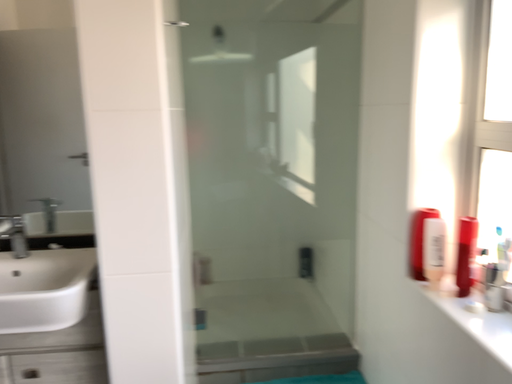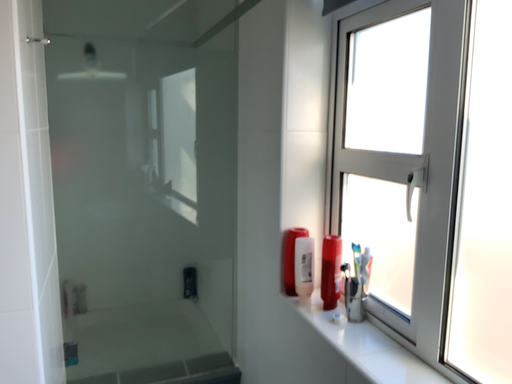
Question: How did the camera likely rotate when shooting the video?

Choices:
 (A) rotated right
 (B) rotated left

Answer: (A)